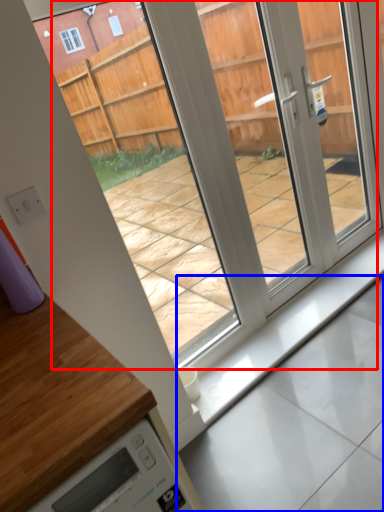
Question: Among these objects, which one is farthest to the camera, glass door (highlighted by a red box) or concrete (highlighted by a blue box)?

Choices:
 (A) glass door
 (B) concrete

Answer: (B)